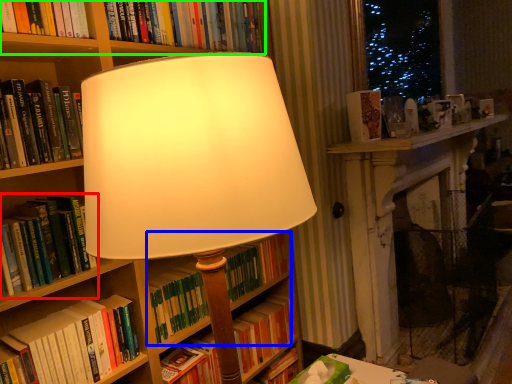
Question: Which object is the farthest from book (highlighted by a red box)? Choose among these: book (highlighted by a blue box) or book (highlighted by a green box).

Choices:
 (A) book
 (B) book

Answer: (B)